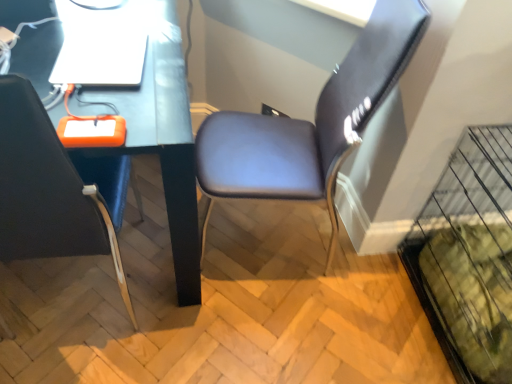
Question: From a real-world perspective, is suede-like brown chair at center-right, which appears as the 2th chair when viewed from the left, on top of matte black desk at center?

Choices:
 (A) no
 (B) yes

Answer: (B)

Question: Is suede-like brown chair at center-right, which is counted as the 1th chair, starting from the right, thinner than matte black desk at center?

Choices:
 (A) yes
 (B) no

Answer: (A)

Question: Could you tell me if suede-like brown chair at center-right, which is counted as the 1th chair, starting from the right, is turned towards matte black desk at center?

Choices:
 (A) yes
 (B) no

Answer: (A)

Question: Is there a large distance between suede-like brown chair at center-right, which appears as the 2th chair when viewed from the left, and matte black desk at center?

Choices:
 (A) no
 (B) yes

Answer: (A)

Question: From the image's perspective, is suede-like brown chair at center-right, which is counted as the 1th chair, starting from the right, located above matte black desk at center?

Choices:
 (A) yes
 (B) no

Answer: (A)

Question: Can matte black desk at center be found inside suede-like brown chair at center-right, which is counted as the 1th chair, starting from the right?

Choices:
 (A) no
 (B) yes

Answer: (A)

Question: Is matte black chair at left, which is the 1th chair from left to right, further to the viewer compared to matte black desk at center?

Choices:
 (A) no
 (B) yes

Answer: (A)

Question: Is matte black chair at left, which is the 1th chair from left to right, bigger than matte black desk at center?

Choices:
 (A) yes
 (B) no

Answer: (B)

Question: From the image's perspective, is matte black chair at left, which is the 1th chair from left to right, over matte black desk at center?

Choices:
 (A) no
 (B) yes

Answer: (A)

Question: Is matte black desk at center surrounded by matte black chair at left, placed as the 2th chair when sorted from right to left?

Choices:
 (A) yes
 (B) no

Answer: (B)

Question: Considering the relative positions of matte black chair at left, placed as the 2th chair when sorted from right to left, and matte black desk at center in the image provided, is matte black chair at left, placed as the 2th chair when sorted from right to left, to the right of matte black desk at center from the viewer's perspective?

Choices:
 (A) no
 (B) yes

Answer: (B)

Question: Can you confirm if matte black chair at left, which is the 1th chair from left to right, is wider than matte black desk at center?

Choices:
 (A) no
 (B) yes

Answer: (A)

Question: From a real-world perspective, is matte black desk at center over suede-like brown chair at center-right, which appears as the 2th chair when viewed from the left?

Choices:
 (A) yes
 (B) no

Answer: (B)